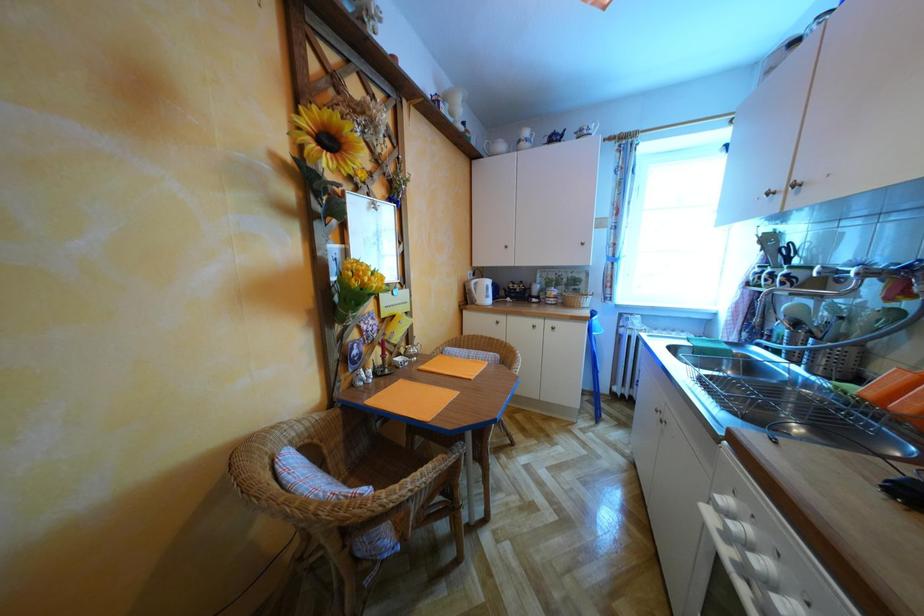
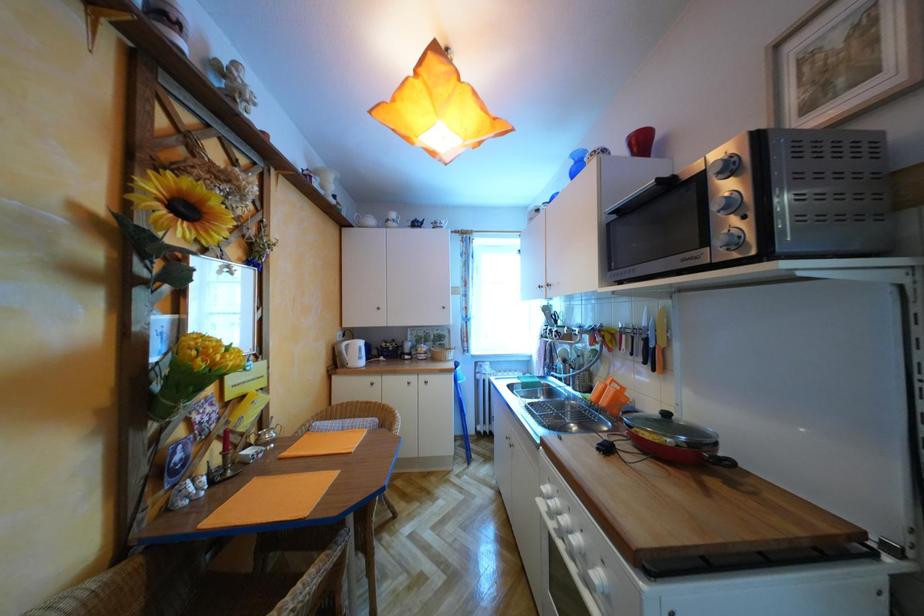
Question: The camera is either moving clockwise (left) or counter-clockwise (right) around the object. The first image is from the beginning of the video and the second image is from the end. Is the camera moving left or right when shooting the video?

Choices:
 (A) Left
 (B) Right

Answer: (A)